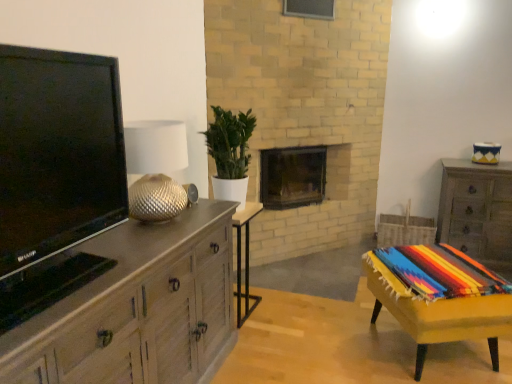
At what (x,y) coordinates should I click in order to perform the action: click on free spot below matte black tv at left (from a real-world perspective). Please return your answer as a coordinate pair (x, y). Looking at the image, I should click on (80, 273).